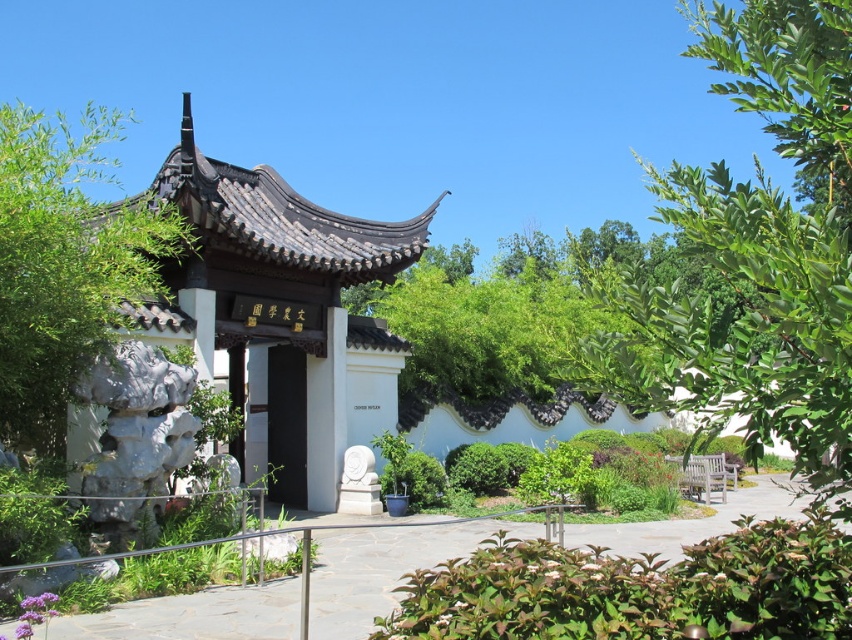
Does smooth stone pathway at center appear under black matte door at center?

Yes.

Which is above, smooth stone pathway at center or black matte door at center?

black matte door at center is higher up.

Describe the element at coordinates (381, 563) in the screenshot. I see `smooth stone pathway at center` at that location.

I want to click on smooth stone pathway at center, so click(381, 563).

Consider the image. Who is more forward, (210, 285) or (14, 413)?

Point (14, 413)

Describe the element at coordinates (275, 307) in the screenshot. I see `white matte gazebo at center` at that location.

Image resolution: width=852 pixels, height=640 pixels. I want to click on white matte gazebo at center, so click(x=275, y=307).

Identify the location of white matte gazebo at center. The image size is (852, 640). (275, 307).

In order to click on green leafy tree at upper right in this screenshot , I will do `click(757, 253)`.

Is green leafy tree at upper right positioned before white matte gazebo at center?

That is True.

Is point (723, 13) behind point (240, 364)?

No, (723, 13) is closer to viewer.

Identify the location of green leafy tree at upper right. Image resolution: width=852 pixels, height=640 pixels. (757, 253).